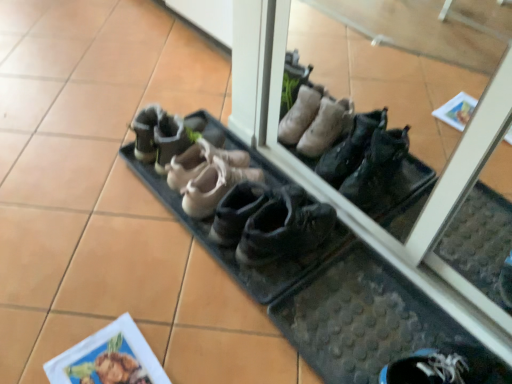
Describe the element at coordinates (214, 186) in the screenshot. I see `leather shoes at center, which is counted as the second footwear, starting from the right` at that location.

I want to click on matte paper at lower left, so 108,358.

Measure the distance between point [133,157] and camera.

Point [133,157] and camera are 4.51 feet apart.

Find the location of a particular element. black rubber boot at center, the first footwear from the right is located at coordinates (284, 227).

You are a GUI agent. You are given a task and a screenshot of the screen. Output one action in this format:
    pyautogui.click(x=<x>, y=<y>)
    Task: Click on the leather/soft suede ballet flats at center, positioned as the fourth footwear in right-to-left order
    This screenshot has height=384, width=512.
    Given the screenshot: What is the action you would take?
    pyautogui.click(x=200, y=162)

This screenshot has width=512, height=384. Find the location of `leather shoes at center, the 3th footwear viewed from the left`. leather shoes at center, the 3th footwear viewed from the left is located at coordinates (214, 186).

Is leather shoes at center, which is counted as the second footwear, starting from the right, positioned with its back to brown suede shoes at center, marked as the third footwear in a right-to-left arrangement?

No, brown suede shoes at center, marked as the third footwear in a right-to-left arrangement, is not at the back of leather shoes at center, which is counted as the second footwear, starting from the right.

Considering the relative positions of leather shoes at center, which is counted as the second footwear, starting from the right, and brown suede shoes at center, acting as the second footwear starting from the left, in the image provided, is leather shoes at center, which is counted as the second footwear, starting from the right, to the right of brown suede shoes at center, acting as the second footwear starting from the left, from the viewer's perspective?

Indeed, leather shoes at center, which is counted as the second footwear, starting from the right, is positioned on the right side of brown suede shoes at center, acting as the second footwear starting from the left.

From the image's perspective, relative to brown suede shoes at center, marked as the third footwear in a right-to-left arrangement, is leather shoes at center, the 3th footwear viewed from the left, above or below?

Clearly, from the image's perspective, leather shoes at center, the 3th footwear viewed from the left, is above brown suede shoes at center, marked as the third footwear in a right-to-left arrangement.

From a real-world perspective, count 1st footwears upward from the brown suede shoes at center, acting as the second footwear starting from the left, and point to it. Please provide its 2D coordinates.

[(214, 186)]

Looking at this image, is brown suede shoes at center, acting as the second footwear starting from the left, turned away from black rubber boot at center, the first footwear from the right?

That's not correct — brown suede shoes at center, acting as the second footwear starting from the left, is not looking away from black rubber boot at center, the first footwear from the right.

Considering the points (124, 153) and (294, 233), which point is in front, point (124, 153) or point (294, 233)?

Point (294, 233)

From the image's perspective, is brown suede shoes at center, marked as the third footwear in a right-to-left arrangement, above black rubber boot at center, the first footwear from the right?

Yes.

Is brown suede shoes at center, acting as the second footwear starting from the left, inside or outside of black rubber boot at center, the 4th footwear when ordered from left to right?

brown suede shoes at center, acting as the second footwear starting from the left, is spatially situated outside black rubber boot at center, the 4th footwear when ordered from left to right.

Who is bigger, matte paper at lower left or black rubber boot at center, the first footwear from the right?

black rubber boot at center, the first footwear from the right.

Where is `tile on the left side of black rubber boot at center, the first footwear from the right`? The image size is (512, 384). tile on the left side of black rubber boot at center, the first footwear from the right is located at coordinates (108, 358).

Based on the photo, from the image's perspective, which one is positioned lower, matte paper at lower left or black rubber boot at center, the 4th footwear when ordered from left to right?

matte paper at lower left, from the image's perspective.

Between brown suede shoes at center, marked as the third footwear in a right-to-left arrangement, and matte paper at lower left, which one appears on the right side from the viewer's perspective?

Positioned to the right is brown suede shoes at center, marked as the third footwear in a right-to-left arrangement.

Is brown suede shoes at center, marked as the third footwear in a right-to-left arrangement, placed right next to matte paper at lower left?

No, brown suede shoes at center, marked as the third footwear in a right-to-left arrangement, is not touching matte paper at lower left.

How far apart are brown suede shoes at center, marked as the third footwear in a right-to-left arrangement, and matte paper at lower left?

brown suede shoes at center, marked as the third footwear in a right-to-left arrangement, and matte paper at lower left are 16.18 inches apart from each other.

Is brown suede shoes at center, acting as the second footwear starting from the left, further to camera compared to matte paper at lower left?

Yes, it is.

Would you consider leather shoes at center, the 3th footwear viewed from the left, to be distant from black rubber boot at center, the first footwear from the right?

Actually, leather shoes at center, the 3th footwear viewed from the left, and black rubber boot at center, the first footwear from the right, are a little close together.

Can you confirm if leather shoes at center, which is counted as the second footwear, starting from the right, is bigger than black rubber boot at center, the 4th footwear when ordered from left to right?

Actually, leather shoes at center, which is counted as the second footwear, starting from the right, might be smaller than black rubber boot at center, the 4th footwear when ordered from left to right.

How many degrees apart are the facing directions of leather shoes at center, the 3th footwear viewed from the left, and black rubber boot at center, the first footwear from the right?

The facing directions of leather shoes at center, the 3th footwear viewed from the left, and black rubber boot at center, the first footwear from the right, are 3.94 degrees apart.

Which point is more distant from viewer, (250, 173) or (277, 242)?

The point (250, 173) is behind.

From the image's perspective, is leather/soft suede ballet flats at center, positioned as the fourth footwear in right-to-left order, above brown suede shoes at center, marked as the third footwear in a right-to-left arrangement?

Yes, from the image's perspective, leather/soft suede ballet flats at center, positioned as the fourth footwear in right-to-left order, is above brown suede shoes at center, marked as the third footwear in a right-to-left arrangement.

From a real-world perspective, is leather/soft suede ballet flats at center, positioned as the 1th footwear in left-to-right order, physically above brown suede shoes at center, acting as the second footwear starting from the left?

Indeed, from a real-world perspective, leather/soft suede ballet flats at center, positioned as the 1th footwear in left-to-right order, stands above brown suede shoes at center, acting as the second footwear starting from the left.

How many degrees apart are the facing directions of leather/soft suede ballet flats at center, positioned as the fourth footwear in right-to-left order, and brown suede shoes at center, acting as the second footwear starting from the left?

They differ by 11.1 degrees in their facing directions.

Is point (172, 187) behind point (259, 235)?

Yes.

From a real-world perspective, is leather/soft suede ballet flats at center, positioned as the fourth footwear in right-to-left order, beneath leather shoes at center, which is counted as the second footwear, starting from the right?

No, from a real-world perspective, leather/soft suede ballet flats at center, positioned as the fourth footwear in right-to-left order, is not below leather shoes at center, which is counted as the second footwear, starting from the right.

From the image's perspective, which one is positioned lower, leather/soft suede ballet flats at center, positioned as the fourth footwear in right-to-left order, or leather shoes at center, which is counted as the second footwear, starting from the right?

leather shoes at center, which is counted as the second footwear, starting from the right, appears lower in the image.

Can you confirm if leather/soft suede ballet flats at center, positioned as the 1th footwear in left-to-right order, is taller than leather shoes at center, which is counted as the second footwear, starting from the right?

Incorrect, the height of leather/soft suede ballet flats at center, positioned as the 1th footwear in left-to-right order, is not larger of that of leather shoes at center, which is counted as the second footwear, starting from the right.

You are a GUI agent. You are given a task and a screenshot of the screen. Output one action in this format:
    pyautogui.click(x=<x>, y=<y>)
    Task: Click on the footwear above the leather shoes at center, which is counted as the second footwear, starting from the right (from the image's perspective)
    The image size is (512, 384).
    Given the screenshot: What is the action you would take?
    pyautogui.click(x=200, y=162)

Where is `the 1st footwear in front of the leather shoes at center, the 3th footwear viewed from the left, counting from the anchor's position`? The image size is (512, 384). the 1st footwear in front of the leather shoes at center, the 3th footwear viewed from the left, counting from the anchor's position is located at coordinates (295, 238).

This screenshot has height=384, width=512. In the image, there is a brown suede shoes at center, marked as the third footwear in a right-to-left arrangement. Identify the location of footwear below it (from the image's perspective). (284, 227).

Considering their positions, is black rubber boot at center, the first footwear from the right, positioned closer to leather/soft suede ballet flats at center, positioned as the 1th footwear in left-to-right order, than brown suede shoes at center, marked as the third footwear in a right-to-left arrangement?

brown suede shoes at center, marked as the third footwear in a right-to-left arrangement, is closer to leather/soft suede ballet flats at center, positioned as the 1th footwear in left-to-right order.

Looking at the image, which one is located further to leather/soft suede ballet flats at center, positioned as the 1th footwear in left-to-right order, brown suede shoes at center, marked as the third footwear in a right-to-left arrangement, or leather shoes at center, which is counted as the second footwear, starting from the right?

The object further to leather/soft suede ballet flats at center, positioned as the 1th footwear in left-to-right order, is brown suede shoes at center, marked as the third footwear in a right-to-left arrangement.

When comparing their distances from leather/soft suede ballet flats at center, positioned as the 1th footwear in left-to-right order, does leather shoes at center, which is counted as the second footwear, starting from the right, or black rubber boot at center, the 4th footwear when ordered from left to right, seem further?

black rubber boot at center, the 4th footwear when ordered from left to right, lies further to leather/soft suede ballet flats at center, positioned as the 1th footwear in left-to-right order, than the other object.

Estimate the real-world distances between objects in this image. Which object is further from brown suede shoes at center, marked as the third footwear in a right-to-left arrangement, leather shoes at center, the 3th footwear viewed from the left, or matte paper at lower left?

matte paper at lower left.

Looking at the image, which one is located further to brown suede shoes at center, marked as the third footwear in a right-to-left arrangement, leather/soft suede ballet flats at center, positioned as the 1th footwear in left-to-right order, or leather shoes at center, which is counted as the second footwear, starting from the right?

Among the two, leather/soft suede ballet flats at center, positioned as the 1th footwear in left-to-right order, is located further to brown suede shoes at center, marked as the third footwear in a right-to-left arrangement.

Estimate the real-world distances between objects in this image. Which object is further from leather shoes at center, the 3th footwear viewed from the left, matte paper at lower left or leather/soft suede ballet flats at center, positioned as the 1th footwear in left-to-right order?

The object further to leather shoes at center, the 3th footwear viewed from the left, is matte paper at lower left.

Based on their spatial positions, is leather shoes at center, the 3th footwear viewed from the left, or brown suede shoes at center, acting as the second footwear starting from the left, closer to leather/soft suede ballet flats at center, positioned as the 1th footwear in left-to-right order?

Based on the image, leather shoes at center, the 3th footwear viewed from the left, appears to be nearer to leather/soft suede ballet flats at center, positioned as the 1th footwear in left-to-right order.

Considering their positions, is brown suede shoes at center, acting as the second footwear starting from the left, positioned closer to matte paper at lower left than black rubber boot at center, the first footwear from the right?

brown suede shoes at center, acting as the second footwear starting from the left, lies closer to matte paper at lower left than the other object.

I want to click on footwear between brown suede shoes at center, acting as the second footwear starting from the left, and leather/soft suede ballet flats at center, positioned as the 1th footwear in left-to-right order, from front to back, so click(214, 186).

Locate an element on the screen. footwear that lies between brown suede shoes at center, acting as the second footwear starting from the left, and matte paper at lower left from top to bottom is located at coordinates (284, 227).

Find the location of a particular element. Image resolution: width=512 pixels, height=384 pixels. footwear between brown suede shoes at center, marked as the third footwear in a right-to-left arrangement, and black rubber boot at center, the 4th footwear when ordered from left to right, from left to right is located at coordinates (214, 186).